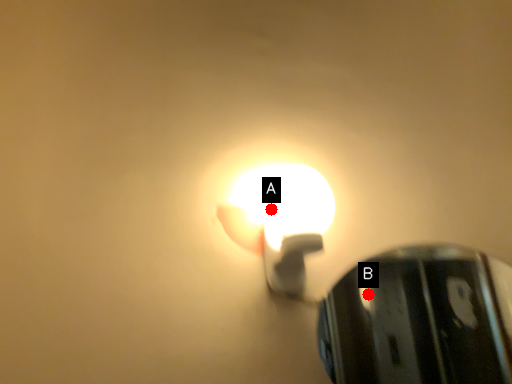
Question: Two points are circled on the image, labeled by A and B beside each circle. Which point is farther from the camera taking this photo?

Choices:
 (A) A is further
 (B) B is further

Answer: (B)